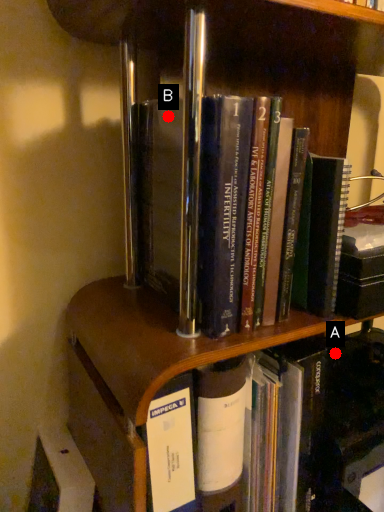
Question: Two points are circled on the image, labeled by A and B beside each circle. Which point is further to the camera?

Choices:
 (A) A is further
 (B) B is further

Answer: (A)